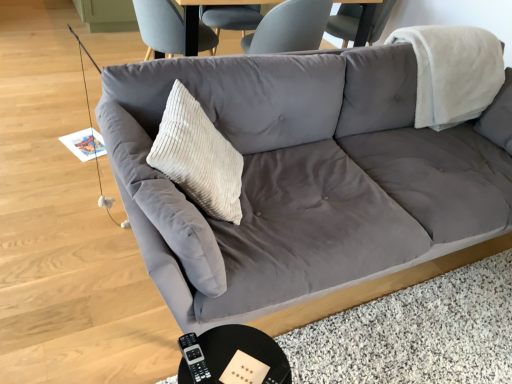
Question: Would you say black glossy round table at lower center is inside or outside suede gray couch at center?

Choices:
 (A) outside
 (B) inside

Answer: (A)

Question: Looking at their shapes, would you say black glossy round table at lower center is wider or thinner than suede gray couch at center?

Choices:
 (A) thin
 (B) wide

Answer: (A)

Question: Which of these objects is positioned closest to the black glossy round table at lower center?

Choices:
 (A) black plastic remote at lower center
 (B) beige corduroy pillow at center
 (C) suede gray couch at center

Answer: (A)

Question: Estimate the real-world distances between objects in this image. Which object is closer to the black glossy round table at lower center?

Choices:
 (A) beige corduroy pillow at center
 (B) suede gray couch at center
 (C) black plastic remote at lower center

Answer: (C)